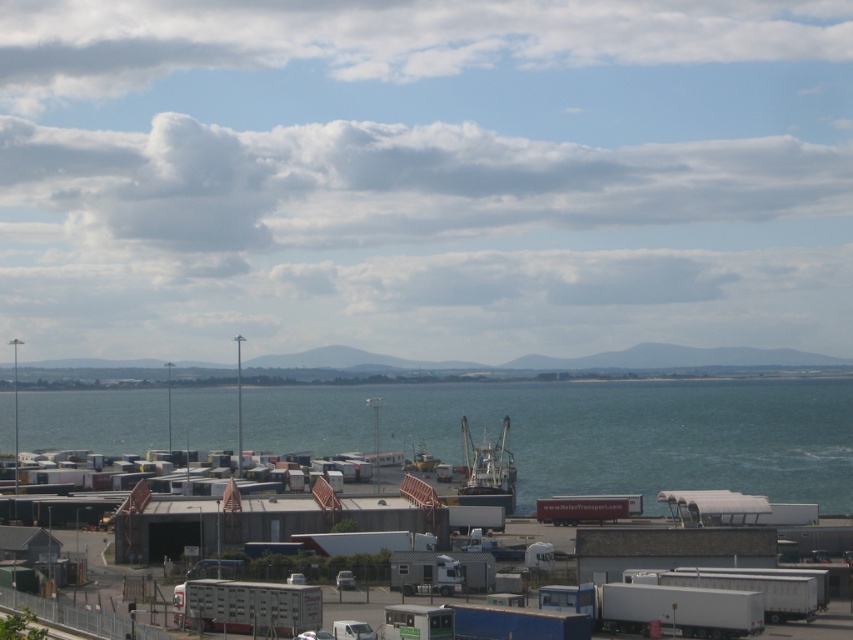
You are a port supervisor checking the parking area. You need to determine if the white metallic trailer truck at lower center can be parked in a space designed for vehicles no larger than the metallic gray boat at center. Based on their sizes, what is your assessment?

The white metallic trailer truck at lower center is smaller than the metallic gray boat at center, so it can be parked in the space designed for vehicles no larger than the metallic gray boat at center.

You are a delivery driver who needs to enter a tunnel with a height restriction of 3 meters. You are currently at the port and see the white metallic trailer truck at lower center and the metallic gray boat at center. Which vehicle is more likely to pass through the tunnel without any issues?

The white metallic trailer truck at lower center has a lesser height compared to the metallic gray boat at center, so it is more likely to pass through the tunnel without any issues.